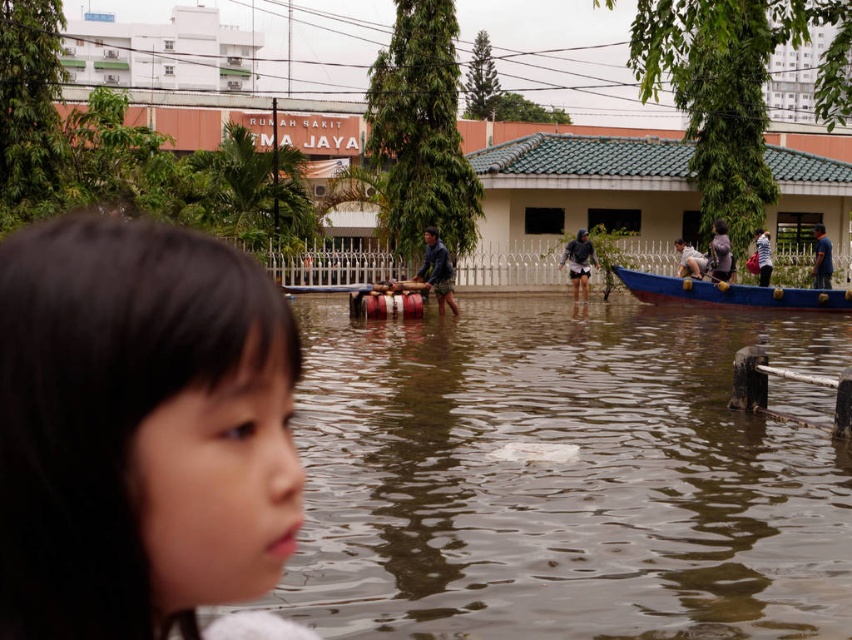
Does brown matte water at center have a greater height compared to blue wooden canoe at right?

Yes.

Does brown matte water at center have a larger size compared to blue wooden canoe at right?

Indeed, brown matte water at center has a larger size compared to blue wooden canoe at right.

Which is behind, point (783, 429) or point (746, 292)?

The point (746, 292) is more distant.

This screenshot has height=640, width=852. In order to click on brown matte water at center in this screenshot , I will do `click(563, 477)`.

Does dark brown hair at lower left have a smaller size compared to wooden boat at center?

Correct, dark brown hair at lower left occupies less space than wooden boat at center.

Is dark brown hair at lower left in front of wooden boat at center?

Yes, dark brown hair at lower left is in front of wooden boat at center.

Who is more distant from viewer, (229, 298) or (366, 284)?

Positioned behind is point (366, 284).

Identify the location of dark brown hair at lower left. (134, 428).

This screenshot has width=852, height=640. What do you see at coordinates (730, 292) in the screenshot? I see `blue wooden canoe at right` at bounding box center [730, 292].

You are a GUI agent. You are given a task and a screenshot of the screen. Output one action in this format:
    pyautogui.click(x=<x>, y=<y>)
    Task: Click on the blue wooden canoe at right
    
    Given the screenshot: What is the action you would take?
    pyautogui.click(x=730, y=292)